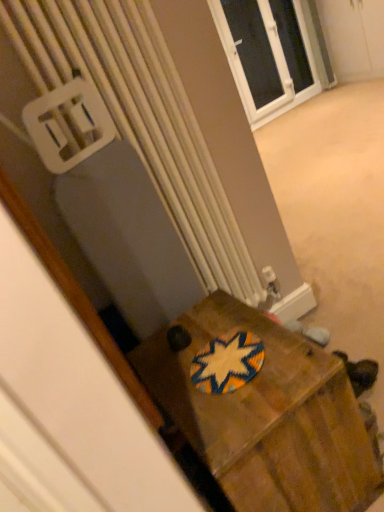
What are the coordinates of `free space in front of woven fabric coaster at center` in the screenshot? It's located at coord(245,408).